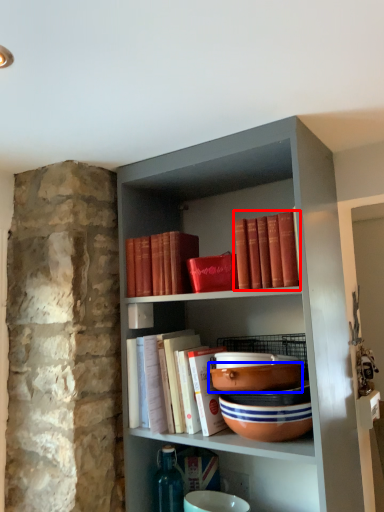
Question: Which point is further to the camera, book (highlighted by a red box) or bowl (highlighted by a blue box)?

Choices:
 (A) book
 (B) bowl

Answer: (B)